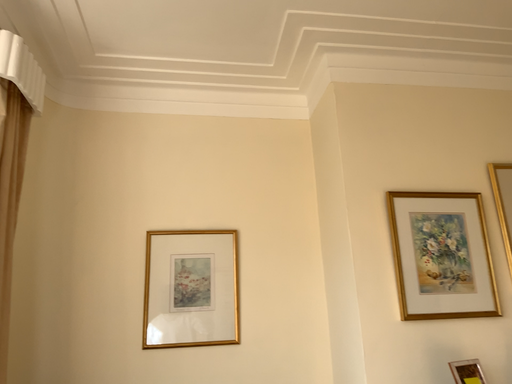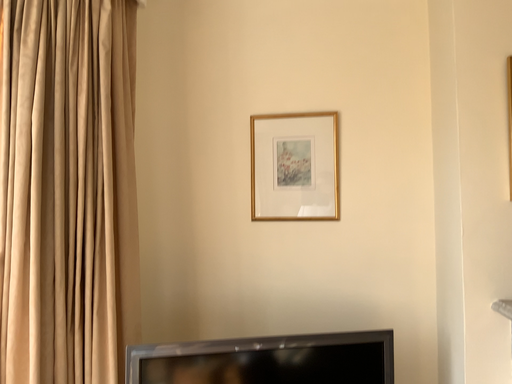
Question: How did the camera likely rotate when shooting the video?

Choices:
 (A) rotated left
 (B) rotated right

Answer: (A)